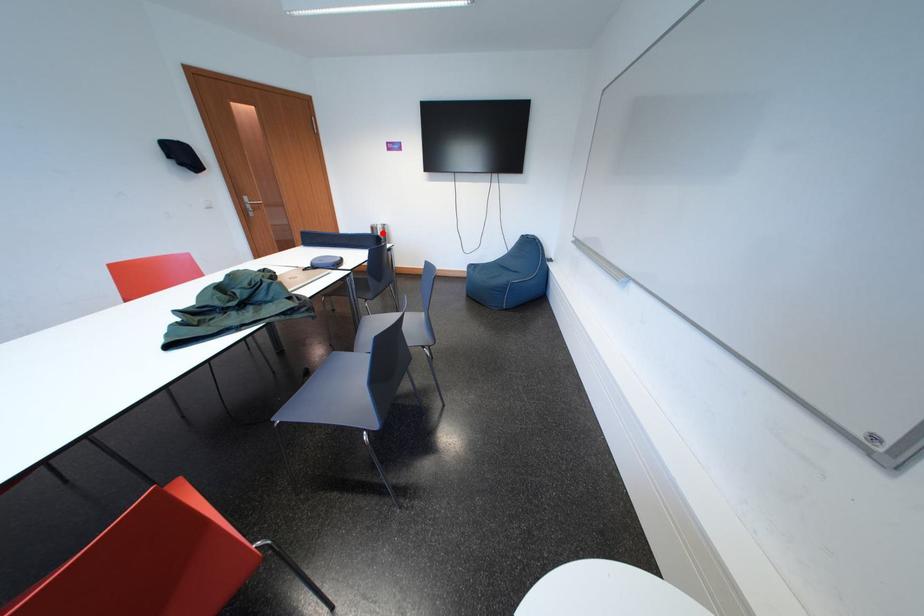
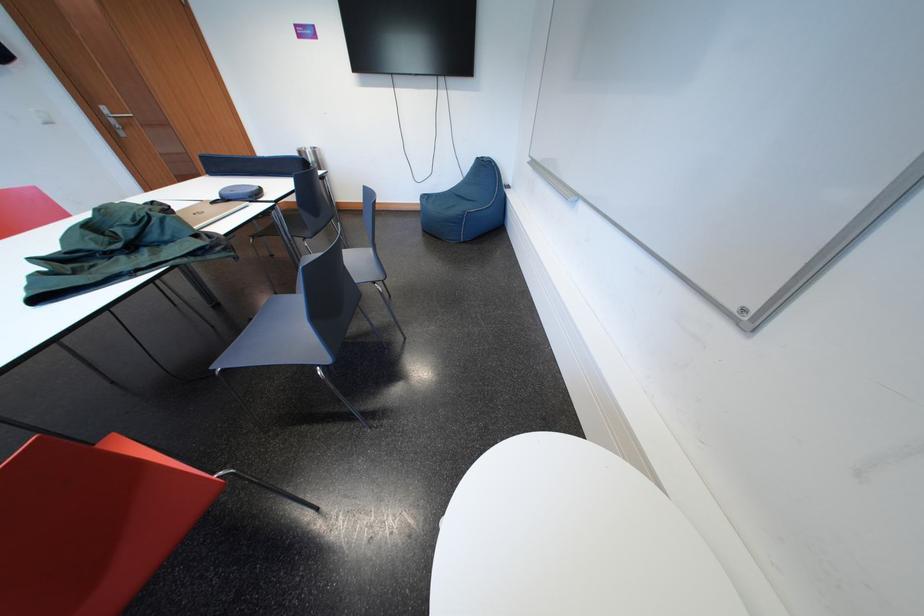
Locate, in the second image, the point that corresponds to the highlighted location in the first image.

(310, 158)